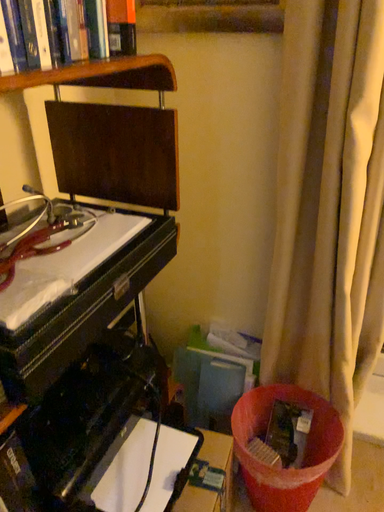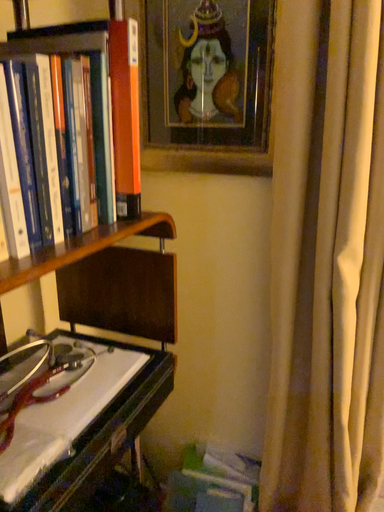
Question: Which way did the camera rotate in the video?

Choices:
 (A) rotated downward
 (B) rotated upward

Answer: (B)